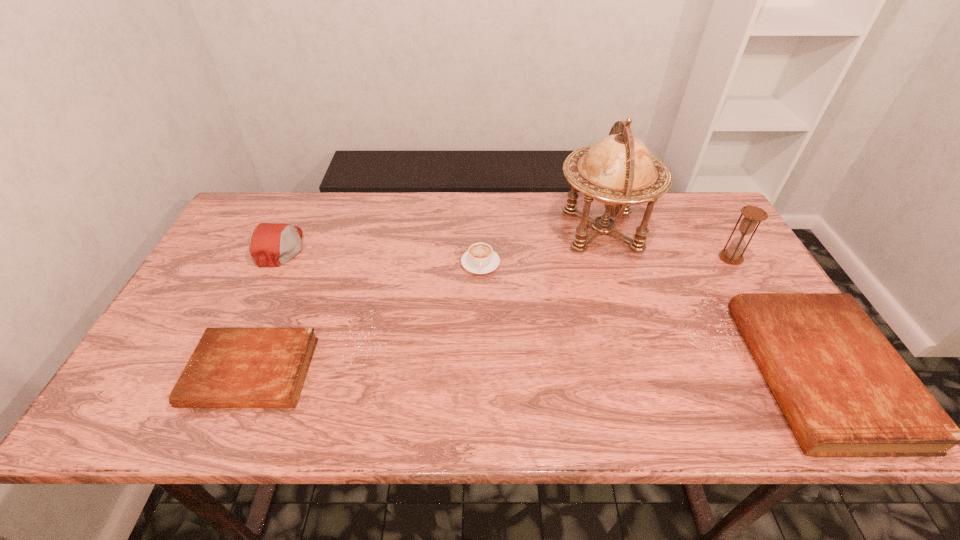
Locate an element on the screen. The height and width of the screenshot is (540, 960). vacant point located between the left Bible and the tallest object is located at coordinates (427, 302).

The width and height of the screenshot is (960, 540). I want to click on free point between the shorter Bible and the third shortest object, so click(536, 373).

Image resolution: width=960 pixels, height=540 pixels. What are the coordinates of `free space between the hourglass and the cappuccino` in the screenshot? It's located at 606,260.

Identify the location of empty location between the taller Bible and the cappuccino. (650, 319).

Find the location of `empty space between the taller Bible and the left Bible`. empty space between the taller Bible and the left Bible is located at coordinates (536, 373).

The height and width of the screenshot is (540, 960). I want to click on vacant space in between the third shortest object and the shorter Bible, so click(536, 373).

What are the coordinates of `free space between the fourth tallest object and the third object from left to right` in the screenshot? It's located at (650, 319).

Locate an element on the screen. The height and width of the screenshot is (540, 960). free space between the fourth shortest object and the taller Bible is located at coordinates (550, 310).

At what (x,y) coordinates should I click in order to perform the action: click on free space that is in between the cappuccino and the left Bible. Please return your answer as a coordinate pair (x, y). The height and width of the screenshot is (540, 960). Looking at the image, I should click on (367, 318).

Identify the location of free spot between the third object from right to left and the fourth shortest object. tap(442, 239).